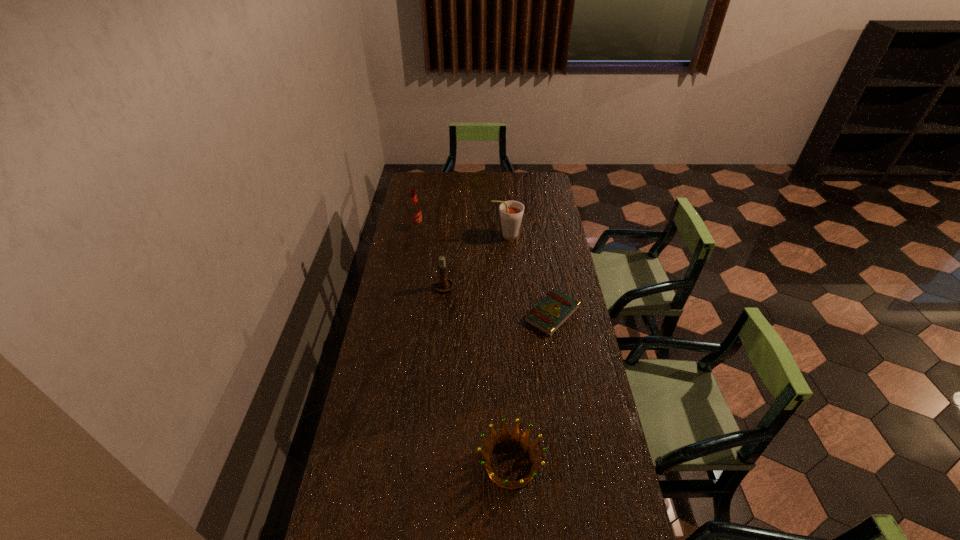
Identify the location of vacant space at the right edge of the desktop. The width and height of the screenshot is (960, 540). (537, 267).

In the image, there is a desktop. Where is `free region at the far left corner`? free region at the far left corner is located at coordinates (420, 179).

In the image, there is a desktop. Where is `vacant space at the far right corner`? The height and width of the screenshot is (540, 960). vacant space at the far right corner is located at coordinates (555, 194).

You are a GUI agent. You are given a task and a screenshot of the screen. Output one action in this format:
    pyautogui.click(x=<x>, y=<y>)
    Task: Click on the free space between the right root beer and the book
    The image size is (960, 540).
    Given the screenshot: What is the action you would take?
    pyautogui.click(x=529, y=275)

Find the location of a particular element. Image resolution: width=960 pixels, height=540 pixels. free space that is in between the book and the leftmost object is located at coordinates (485, 271).

Identify the location of vacant space that is in between the candle holder and the right root beer. The height and width of the screenshot is (540, 960). (475, 260).

This screenshot has height=540, width=960. Identify the location of vacant area that lies between the candle holder and the crown. coord(477,375).

You are a GUI agent. You are given a task and a screenshot of the screen. Output one action in this format:
    pyautogui.click(x=<x>, y=<y>)
    Task: Click on the vacant space that is in between the candle holder and the left root beer
    
    Given the screenshot: What is the action you would take?
    pyautogui.click(x=430, y=256)

The height and width of the screenshot is (540, 960). What are the coordinates of `unoccupied area between the fourth object from right to left and the nearest object` in the screenshot? It's located at (477, 375).

The width and height of the screenshot is (960, 540). I want to click on vacant area that lies between the nearest object and the left root beer, so click(464, 346).